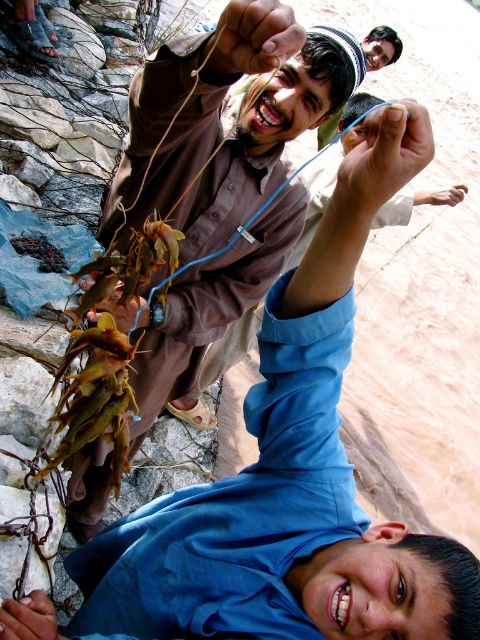
You are standing in the scene and want to place a small flag at the closest point to you between the two points labeled point [364,147] and point [452,202]. Which point should you choose?

You should choose point [364,147] because it is closer to you than point [452,202].

You are a photographer observing the scene. You need to position a camera to capture both the smooth skin hand at lower left and the matte brown hand at upper center in the frame. Which hand should you focus on first to ensure both are in the shot?

The smooth skin hand at lower left is shorter than the matte brown hand at upper center. To capture both in the frame, focus on the matte brown hand at upper center first as it is higher up, ensuring the lower hand will also be within the camera view.